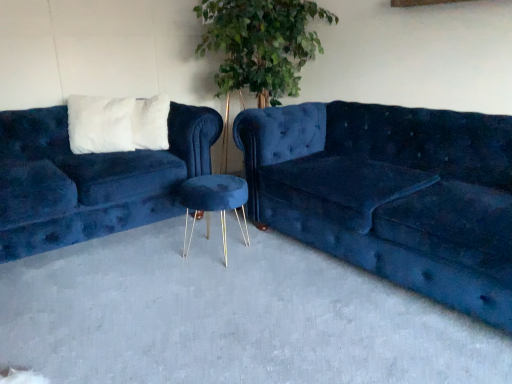
The width and height of the screenshot is (512, 384). What are the coordinates of `vacant area that lies between velvet blue couch at left, which ranks as the first studio couch in left-to-right order, and velvet blue stool at center` in the screenshot? It's located at (134, 254).